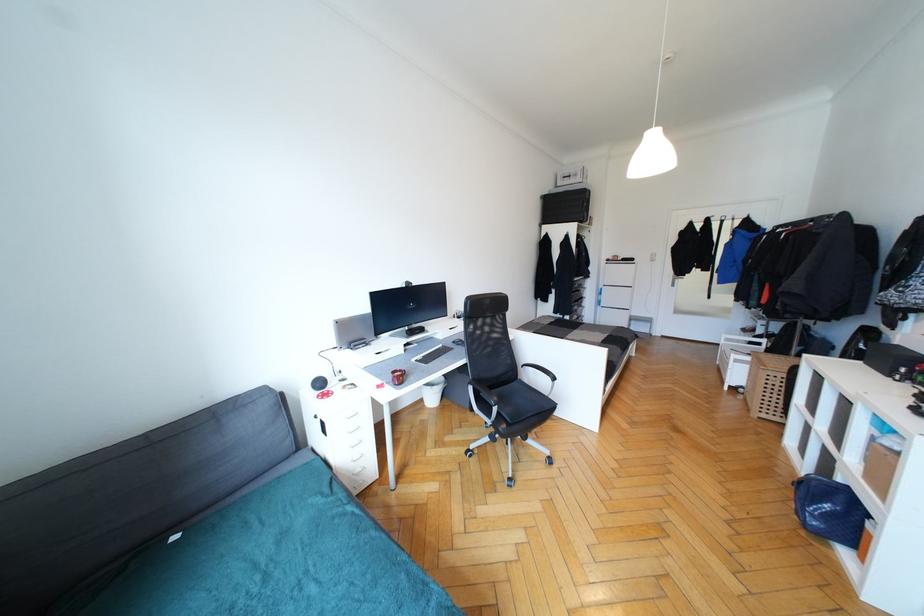
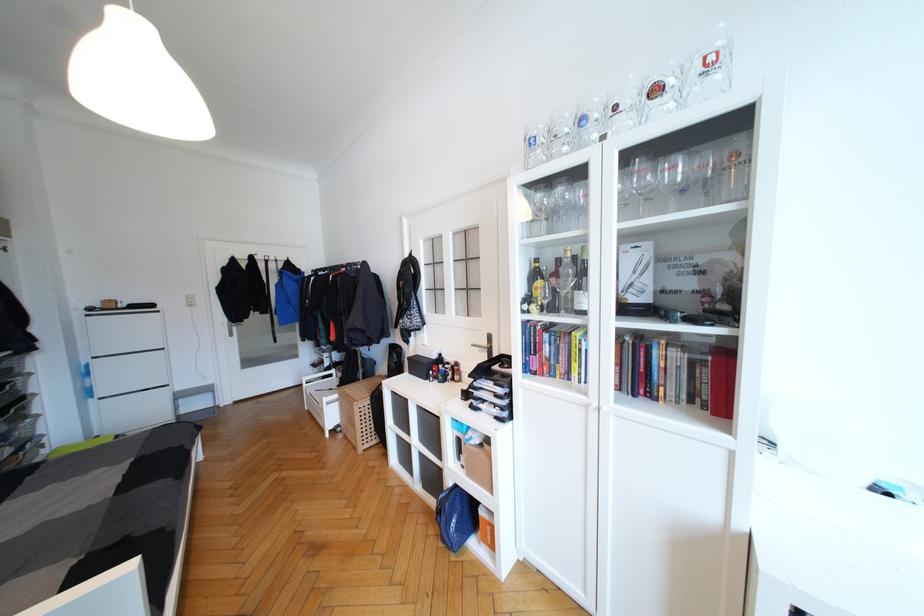
The point at (628, 315) is marked in the first image. Where is the corresponding point in the second image?

(166, 397)